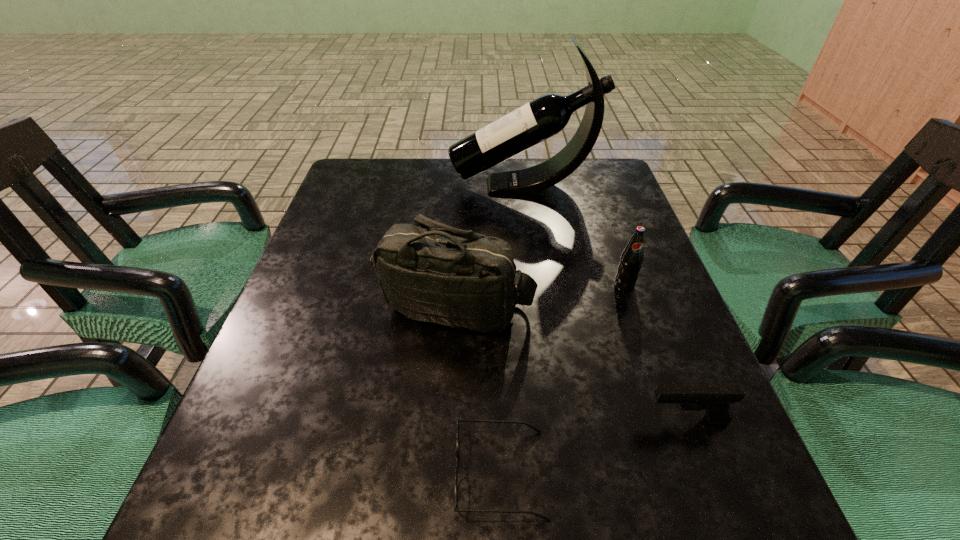
The image size is (960, 540). What are the coordinates of `the tallest object` in the screenshot? It's located at pyautogui.click(x=547, y=115).

You are a GUI agent. You are given a task and a screenshot of the screen. Output one action in this format:
    pyautogui.click(x=<x>, y=<y>)
    Task: Click on the farthest object
    This screenshot has width=960, height=540.
    Given the screenshot: What is the action you would take?
    pyautogui.click(x=547, y=115)

Locate an element on the screen. The width and height of the screenshot is (960, 540). the fourth shortest object is located at coordinates (429, 272).

Locate an element on the screen. pop is located at coordinates (632, 257).

Image resolution: width=960 pixels, height=540 pixels. Find the location of `the fourth farthest object`. the fourth farthest object is located at coordinates (715, 399).

Find the location of `the second shortest object`. the second shortest object is located at coordinates (715, 399).

The image size is (960, 540). In order to click on spectacles in this screenshot , I will do `click(459, 420)`.

Identify the location of the nearest object. This screenshot has height=540, width=960. (459, 420).

You are a GUI agent. You are given a task and a screenshot of the screen. Output one action in this format:
    pyautogui.click(x=<x>, y=<y>)
    Task: Click on the free spot located 0.100m on the stand of the farthest object
    
    Given the screenshot: What is the action you would take?
    pyautogui.click(x=415, y=186)

The image size is (960, 540). I want to click on free space located on the stand of the farthest object, so click(396, 186).